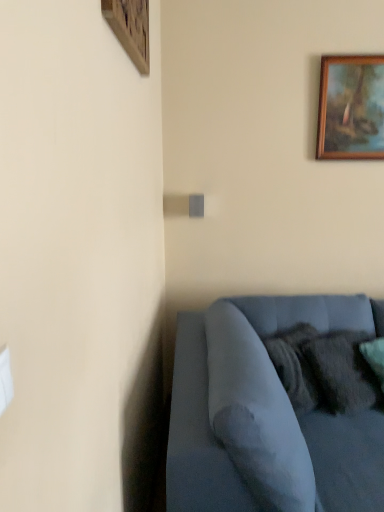
Question: Is velvet blue couch at lower right thinner than wooden picture frame at upper right, the 1th picture frame positioned from the right?

Choices:
 (A) yes
 (B) no

Answer: (B)

Question: Considering the relative positions of velvet blue couch at lower right and wooden picture frame at upper right, which is counted as the second picture frame, starting from the left, in the image provided, is velvet blue couch at lower right to the right of wooden picture frame at upper right, which is counted as the second picture frame, starting from the left, from the viewer's perspective?

Choices:
 (A) no
 (B) yes

Answer: (A)

Question: Considering the relative sizes of velvet blue couch at lower right and wooden picture frame at upper right, which is counted as the second picture frame, starting from the left, in the image provided, is velvet blue couch at lower right smaller than wooden picture frame at upper right, which is counted as the second picture frame, starting from the left,?

Choices:
 (A) yes
 (B) no

Answer: (B)

Question: Does velvet blue couch at lower right come in front of wooden picture frame at upper right, which is counted as the second picture frame, starting from the left?

Choices:
 (A) no
 (B) yes

Answer: (B)

Question: Is velvet blue couch at lower right touching wooden picture frame at upper right, which is the 2th picture frame from front to back?

Choices:
 (A) yes
 (B) no

Answer: (B)

Question: Considering the relative sizes of velvet blue couch at lower right and wooden picture frame at upper right, marked as the 1th picture frame in a back-to-front arrangement, in the image provided, is velvet blue couch at lower right taller than wooden picture frame at upper right, marked as the 1th picture frame in a back-to-front arrangement,?

Choices:
 (A) yes
 (B) no

Answer: (A)

Question: From the image's perspective, would you say velvety dark gray pillow at lower right is shown under wooden picture frame at upper left, which is the first picture frame in left-to-right order?

Choices:
 (A) no
 (B) yes

Answer: (B)

Question: Is velvety dark gray pillow at lower right smaller than wooden picture frame at upper left, which is the first picture frame in left-to-right order?

Choices:
 (A) no
 (B) yes

Answer: (A)

Question: Considering the relative sizes of velvety dark gray pillow at lower right and wooden picture frame at upper left, which is counted as the 1th picture frame, starting from the front, in the image provided, is velvety dark gray pillow at lower right thinner than wooden picture frame at upper left, which is counted as the 1th picture frame, starting from the front,?

Choices:
 (A) no
 (B) yes

Answer: (A)

Question: Is velvety dark gray pillow at lower right further to the viewer compared to wooden picture frame at upper left, which is counted as the 1th picture frame, starting from the front?

Choices:
 (A) yes
 (B) no

Answer: (A)

Question: Can you confirm if velvety dark gray pillow at lower right is positioned to the right of wooden picture frame at upper left, which is the first picture frame in left-to-right order?

Choices:
 (A) yes
 (B) no

Answer: (A)

Question: Is velvety dark gray pillow at lower right taller than wooden picture frame at upper left, which is counted as the 2th picture frame, starting from the right?

Choices:
 (A) yes
 (B) no

Answer: (A)

Question: Is wooden picture frame at upper left, which is counted as the 2th picture frame, starting from the right, positioned before velvety dark gray pillow at lower right?

Choices:
 (A) yes
 (B) no

Answer: (A)